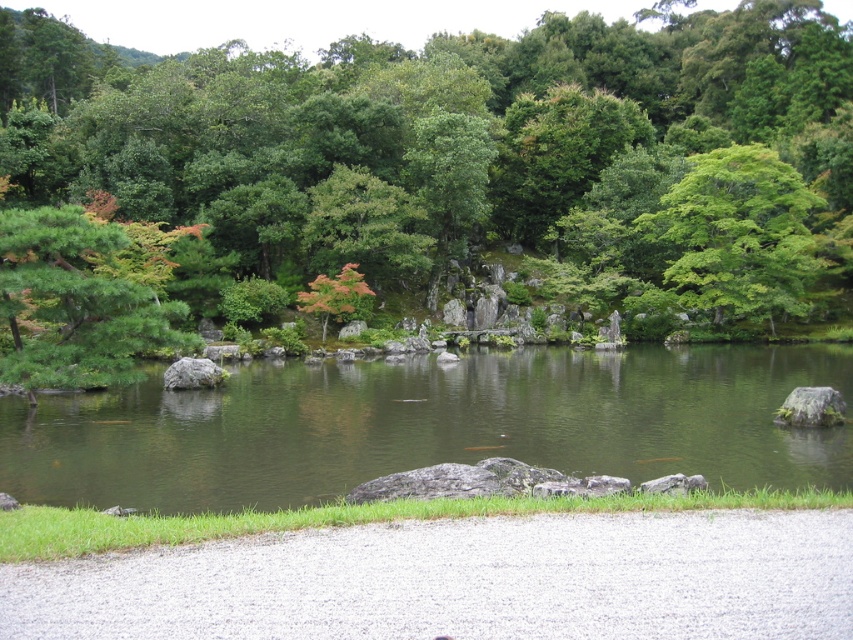
Question: Does green matte tree at left have a smaller size compared to green leafy tree at upper right?

Choices:
 (A) yes
 (B) no

Answer: (B)

Question: Which point is closer to the camera?

Choices:
 (A) (154, 230)
 (B) (352, 284)
 (C) (714, 241)
 (D) (727, 214)

Answer: (A)

Question: Which of the following is the closest to the observer?

Choices:
 (A) green leafy tree at upper right
 (B) green smooth water at center

Answer: (B)

Question: Can you confirm if green smooth water at center is bigger than orange matte tree at center?

Choices:
 (A) no
 (B) yes

Answer: (B)

Question: Considering the real-world distances, which object is farthest from the green matte tree at left?

Choices:
 (A) orange matte tree at center
 (B) green leafy tree at center

Answer: (B)

Question: Is green matte tree at left further to the viewer compared to green leafy tree at upper right?

Choices:
 (A) no
 (B) yes

Answer: (A)